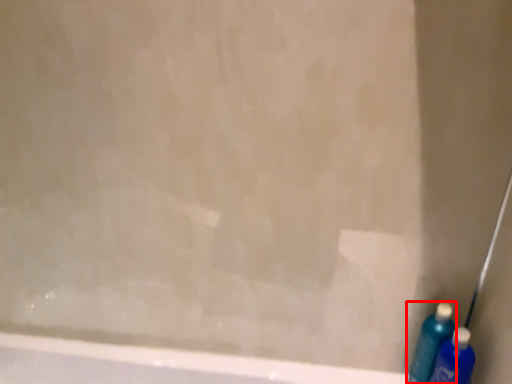
Question: From the image, what is the correct spatial relationship of cleaning product (annotated by the red box) in relation to cleaning product?

Choices:
 (A) left
 (B) right

Answer: (A)